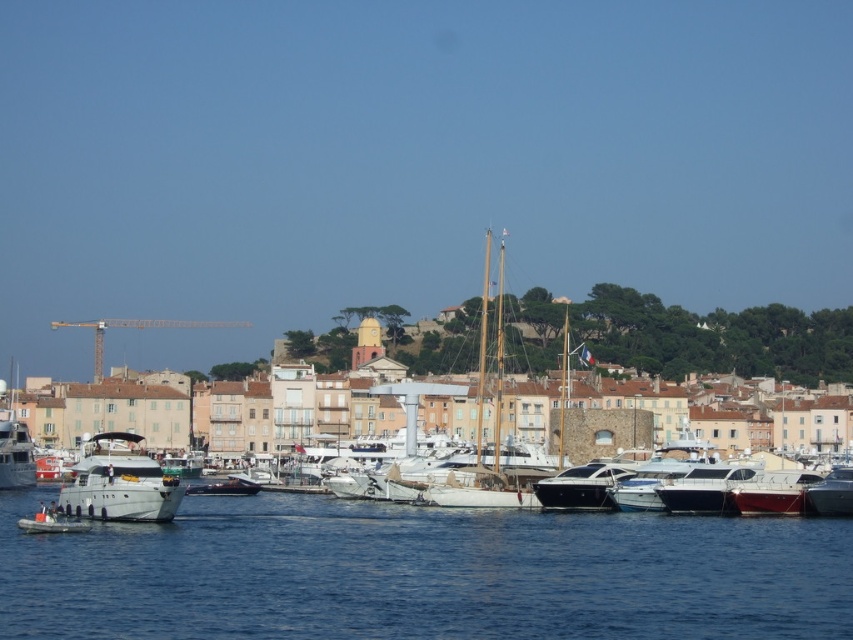
Between blue water at lower center and shiny silver yacht at lower right, which one appears on the left side from the viewer's perspective?

From the viewer's perspective, blue water at lower center appears more on the left side.

Is blue water at lower center smaller than shiny silver yacht at lower right?

Incorrect, blue water at lower center is not smaller in size than shiny silver yacht at lower right.

The width and height of the screenshot is (853, 640). What do you see at coordinates (422, 573) in the screenshot?
I see `blue water at lower center` at bounding box center [422, 573].

The width and height of the screenshot is (853, 640). Identify the location of blue water at lower center. (422, 573).

Is point (552, 492) positioned after point (836, 472)?

No, (552, 492) is closer to viewer.

Does point (590, 464) lie in front of point (840, 484)?

That is False.

Between point (553, 493) and point (834, 493), which one is positioned behind?

Positioned behind is point (553, 493).

Find the location of `shiny black yacht at center`. shiny black yacht at center is located at coordinates (581, 486).

Does shiny white boat at center right have a lesser width compared to shiny silver yacht at lower right?

No.

Which is behind, point (766, 481) or point (811, 484)?

The point (811, 484) is behind.

The height and width of the screenshot is (640, 853). In order to click on shiny white boat at center right in this screenshot , I will do `click(775, 492)`.